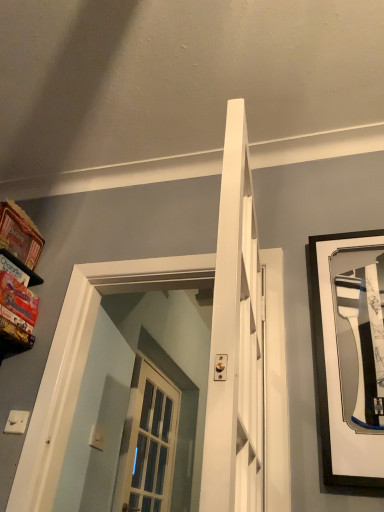
Question: Is white plastic light switch at lower left facing away from matte cardboard shelf at left?

Choices:
 (A) no
 (B) yes

Answer: (A)

Question: Can you confirm if white plastic light switch at lower left is smaller than matte cardboard shelf at left?

Choices:
 (A) no
 (B) yes

Answer: (B)

Question: Does white plastic light switch at lower left turn towards matte cardboard shelf at left?

Choices:
 (A) yes
 (B) no

Answer: (B)

Question: Is white plastic light switch at lower left next to matte cardboard shelf at left?

Choices:
 (A) no
 (B) yes

Answer: (A)

Question: From a real-world perspective, is white plastic light switch at lower left positioned over matte cardboard shelf at left based on gravity?

Choices:
 (A) yes
 (B) no

Answer: (B)

Question: Relative to matte cardboard shelf at left, is black matte picture frame at right in front or behind?

Choices:
 (A) front
 (B) behind

Answer: (A)

Question: Looking at their shapes, would you say black matte picture frame at right is wider or thinner than matte cardboard shelf at left?

Choices:
 (A) thin
 (B) wide

Answer: (A)

Question: Is black matte picture frame at right to the left or to the right of matte cardboard shelf at left in the image?

Choices:
 (A) left
 (B) right

Answer: (B)

Question: In terms of height, does black matte picture frame at right look taller or shorter compared to matte cardboard shelf at left?

Choices:
 (A) tall
 (B) short

Answer: (A)

Question: Is black matte picture frame at right bigger or smaller than white plastic light switch at lower left?

Choices:
 (A) small
 (B) big

Answer: (B)

Question: Does point (345, 369) appear closer or farther from the camera than point (28, 415)?

Choices:
 (A) farther
 (B) closer

Answer: (B)

Question: Choose the correct answer: Is black matte picture frame at right inside white plastic light switch at lower left or outside it?

Choices:
 (A) inside
 (B) outside

Answer: (B)

Question: From their relative heights in the image, would you say black matte picture frame at right is taller or shorter than white plastic light switch at lower left?

Choices:
 (A) short
 (B) tall

Answer: (B)

Question: From the image's perspective, relative to black matte picture frame at right, is matte cardboard shelf at left above or below?

Choices:
 (A) below
 (B) above

Answer: (B)

Question: Considering the positions of point (13, 343) and point (362, 455), is point (13, 343) closer or farther from the camera than point (362, 455)?

Choices:
 (A) farther
 (B) closer

Answer: (A)